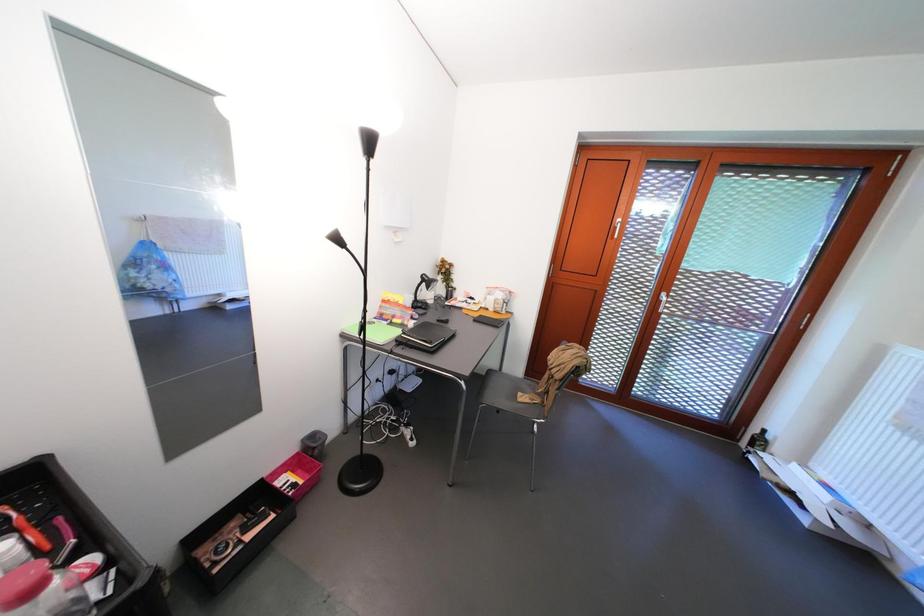
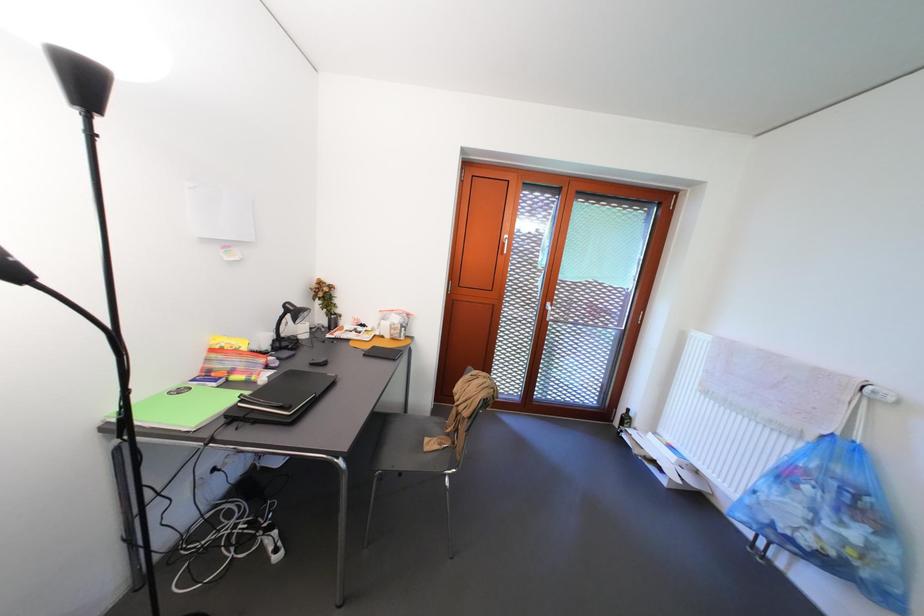
Question: Based on the continuous images, in which direction is the camera rotating? Reply with the corresponding letter.

Choices:
 (A) Left
 (B) Right
 (C) Up
 (D) Down

Answer: (B)